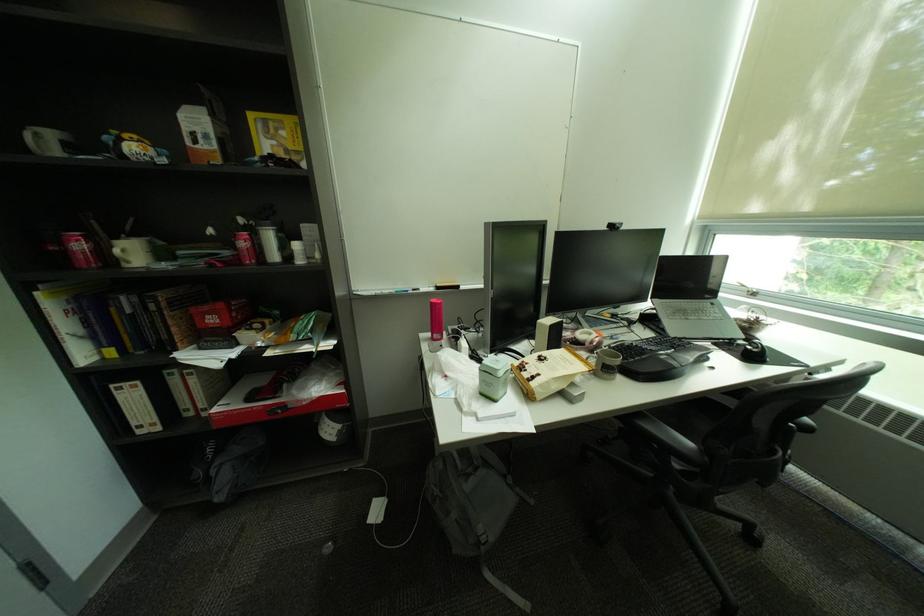
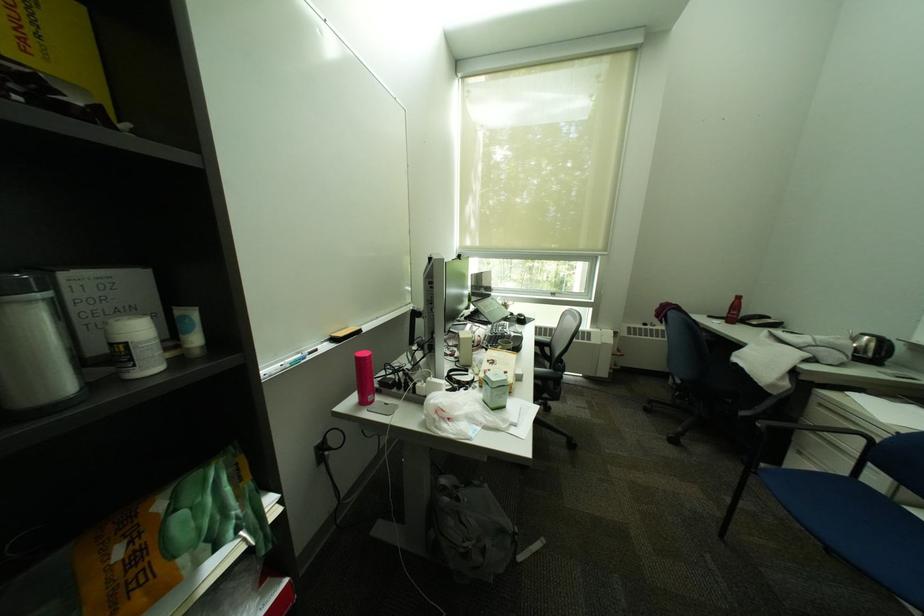
Question: The camera is either moving clockwise (left) or counter-clockwise (right) around the object. The first image is from the beginning of the video and the second image is from the end. Is the camera moving left or right when shooting the video?

Choices:
 (A) Left
 (B) Right

Answer: (A)